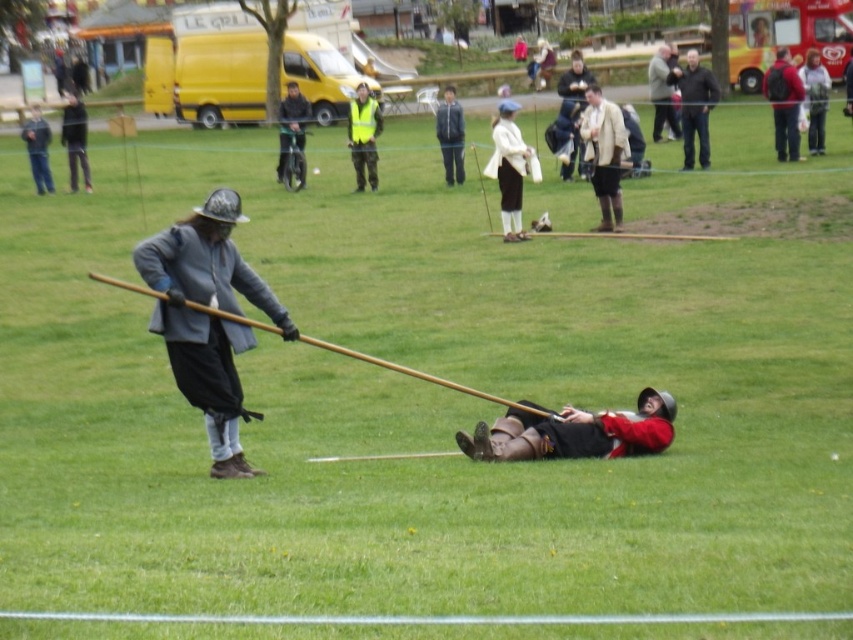
Question: Which of these objects is positioned closest to the matte black helmet at left?

Choices:
 (A) matte beige coat at center
 (B) red leather boots at lower center
 (C) dark gray fabric coat at center

Answer: (C)

Question: Is white woolen sweater at center above brown wood spear at left?

Choices:
 (A) no
 (B) yes

Answer: (B)

Question: Which point is farther to the camera?

Choices:
 (A) (810, 129)
 (B) (302, 179)
 (C) (636, 436)
 (D) (605, 115)

Answer: (B)

Question: Does dark gray fabric coat at center appear on the right side of matte black helmet at left?

Choices:
 (A) no
 (B) yes

Answer: (B)

Question: Which point is closer to the camera taking this photo?

Choices:
 (A) (538, 88)
 (B) (676, 84)
 (C) (22, 128)
 (D) (521, 182)

Answer: (D)

Question: Can you confirm if dark blue jacket at upper right is positioned to the left of matte gray helmet at center?

Choices:
 (A) yes
 (B) no

Answer: (B)